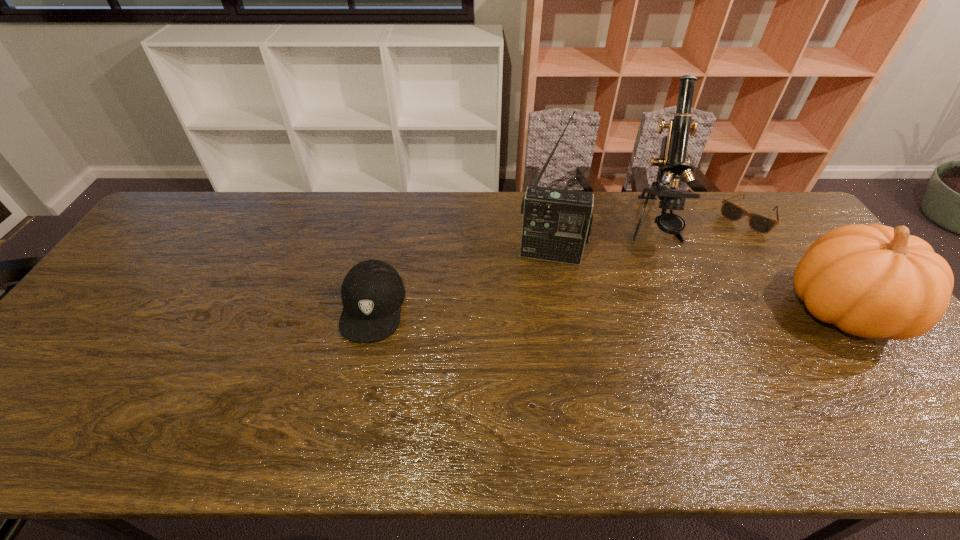
This screenshot has width=960, height=540. What are the coordinates of `the leftmost object` in the screenshot? It's located at (372, 292).

The height and width of the screenshot is (540, 960). I want to click on the fourth tallest object, so click(372, 292).

Where is `pumpkin`? The height and width of the screenshot is (540, 960). pumpkin is located at coordinates (874, 281).

The height and width of the screenshot is (540, 960). In order to click on microscope in this screenshot , I will do `click(672, 162)`.

Locate an element on the screen. Image resolution: width=960 pixels, height=540 pixels. the shortest object is located at coordinates (761, 224).

Where is `radio receiver`? The height and width of the screenshot is (540, 960). radio receiver is located at coordinates (557, 223).

The width and height of the screenshot is (960, 540). Identify the location of free region located on the front-facing side of the cap. click(x=351, y=402).

Identify the location of vacant space located on the front of the pumpkin. This screenshot has height=540, width=960. (896, 383).

At what (x,y) coordinates should I click in order to perform the action: click on free location located through the eyepiece of the microscope. Please return your answer as a coordinate pair (x, y). Looking at the image, I should click on (665, 274).

The width and height of the screenshot is (960, 540). I want to click on vacant point located through the eyepiece of the microscope, so click(677, 320).